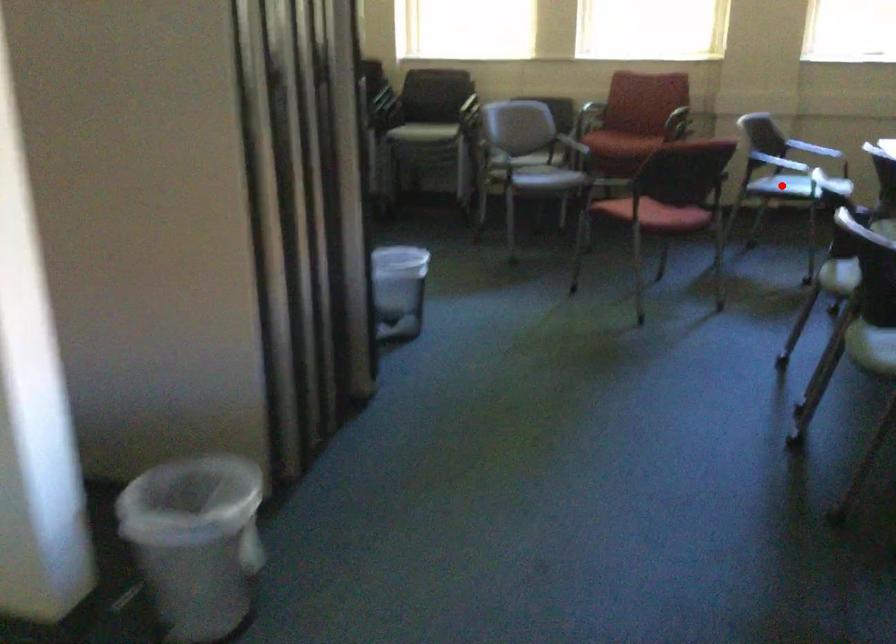
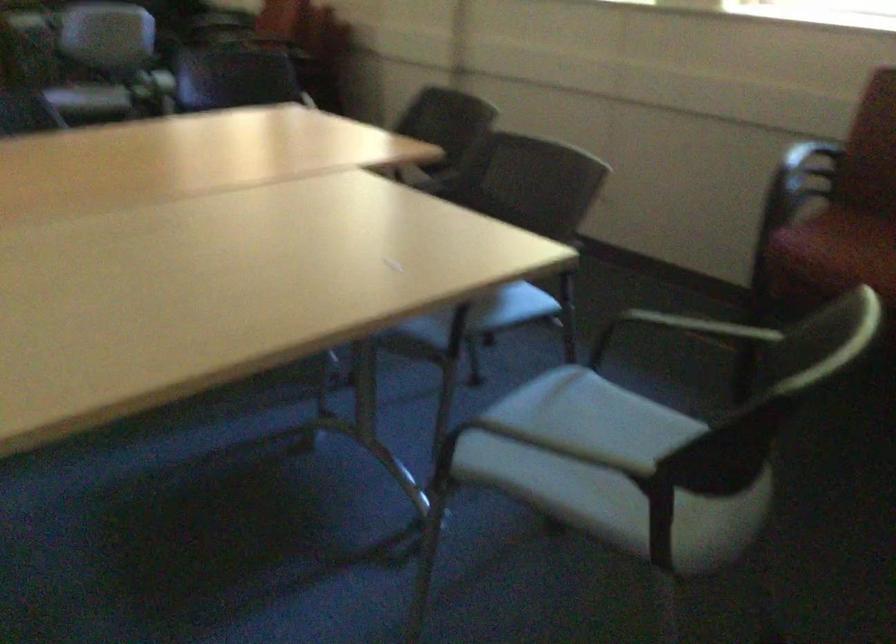
Question: I am providing you with two images of the same scene from different viewpoints. A red point is marked on the first image. At the location where the point appears in image 1, is it still visible in image 2?

Choices:
 (A) Yes
 (B) No

Answer: (B)